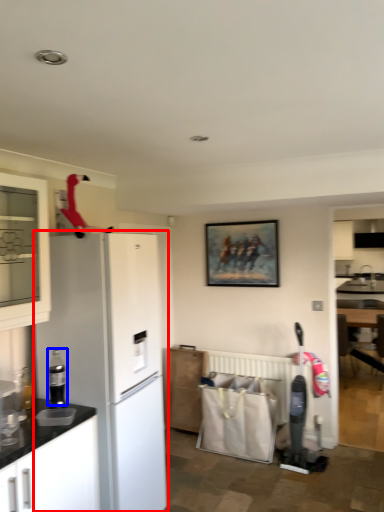
Question: Which of the following is the farthest to the observer, refrigerator (highlighted by a red box) or appliance (highlighted by a blue box)?

Choices:
 (A) refrigerator
 (B) appliance

Answer: (A)